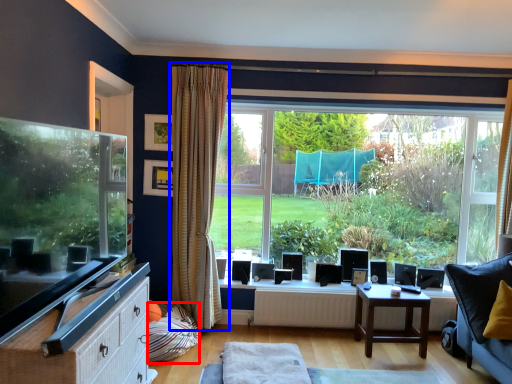
Question: Among these objects, which one is farthest to the camera, pillow (highlighted by a red box) or curtain (highlighted by a blue box)?

Choices:
 (A) pillow
 (B) curtain

Answer: (B)